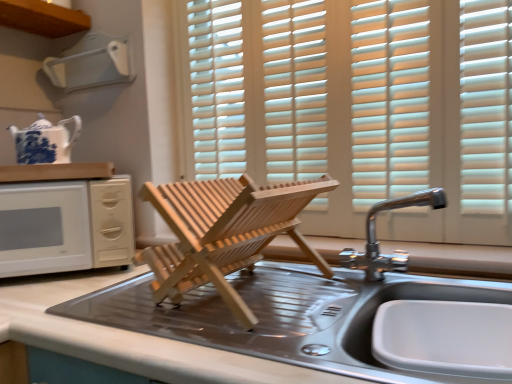
Question: Does chrome metallic faucet at upper right appear on the left side of white matte microwave at left?

Choices:
 (A) no
 (B) yes

Answer: (A)

Question: From the image's perspective, does chrome metallic faucet at upper right appear lower than white matte microwave at left?

Choices:
 (A) no
 (B) yes

Answer: (A)

Question: Is chrome metallic faucet at upper right smaller than white matte microwave at left?

Choices:
 (A) no
 (B) yes

Answer: (B)

Question: Is white matte microwave at left at the back of chrome metallic faucet at upper right?

Choices:
 (A) no
 (B) yes

Answer: (A)

Question: Considering the relative sizes of chrome metallic faucet at upper right and white matte microwave at left in the image provided, is chrome metallic faucet at upper right wider than white matte microwave at left?

Choices:
 (A) yes
 (B) no

Answer: (B)

Question: Is chrome metallic faucet at upper right thinner than white matte microwave at left?

Choices:
 (A) no
 (B) yes

Answer: (B)

Question: Is metallic stainless steel sink at center located outside white wood blinds at center?

Choices:
 (A) no
 (B) yes

Answer: (B)

Question: From a real-world perspective, does metallic stainless steel sink at center stand above white wood blinds at center?

Choices:
 (A) yes
 (B) no

Answer: (B)

Question: Does metallic stainless steel sink at center have a smaller size compared to white wood blinds at center?

Choices:
 (A) no
 (B) yes

Answer: (B)

Question: Considering the relative sizes of metallic stainless steel sink at center and white wood blinds at center in the image provided, is metallic stainless steel sink at center bigger than white wood blinds at center?

Choices:
 (A) yes
 (B) no

Answer: (B)

Question: From a real-world perspective, is metallic stainless steel sink at center located beneath white wood blinds at center?

Choices:
 (A) yes
 (B) no

Answer: (A)

Question: Considering the relative positions of metallic stainless steel sink at center and white wood blinds at center in the image provided, is metallic stainless steel sink at center in front of white wood blinds at center?

Choices:
 (A) yes
 (B) no

Answer: (A)

Question: Is white wood blinds at center shorter than metallic stainless steel sink at center, placed as the 2th countertop when sorted from top to bottom?

Choices:
 (A) yes
 (B) no

Answer: (B)